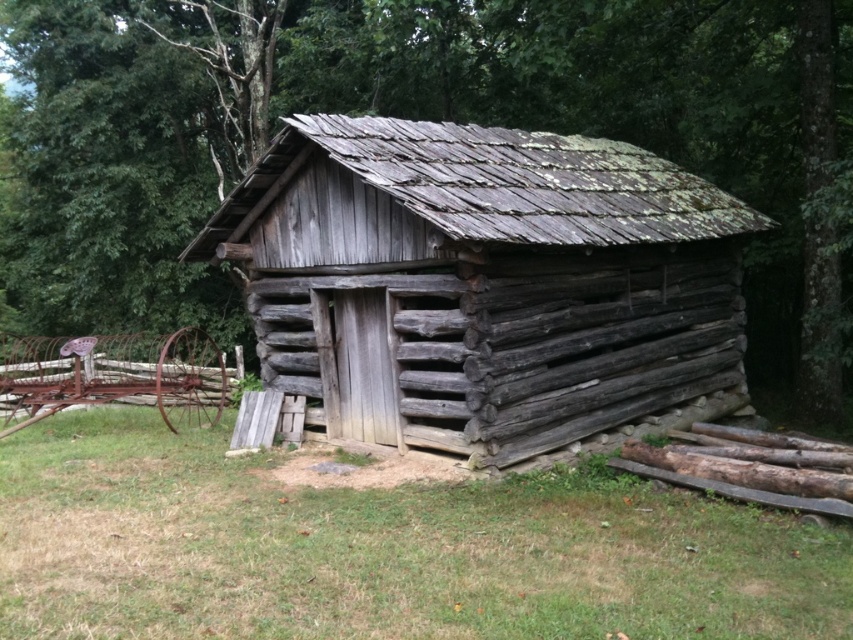
Question: Which point is closer to the camera?

Choices:
 (A) (32, 376)
 (B) (827, 120)
 (C) (392, 282)

Answer: (C)

Question: Which object is farther from the camera taking this photo?

Choices:
 (A) green grass at lower center
 (B) green mossy tree at upper center

Answer: (B)

Question: Which point is farther to the camera?

Choices:
 (A) (180, 413)
 (B) (456, 120)
 (C) (366, 400)

Answer: (B)

Question: From the image, what is the correct spatial relationship of weathered wood log cabin at center in relation to rusty metal fence at left?

Choices:
 (A) left
 (B) right

Answer: (B)

Question: Does weathered wood log cabin at center have a smaller size compared to rusty metal fence at left?

Choices:
 (A) no
 (B) yes

Answer: (B)

Question: Does green mossy tree at upper center appear over rusty metal fence at left?

Choices:
 (A) no
 (B) yes

Answer: (B)